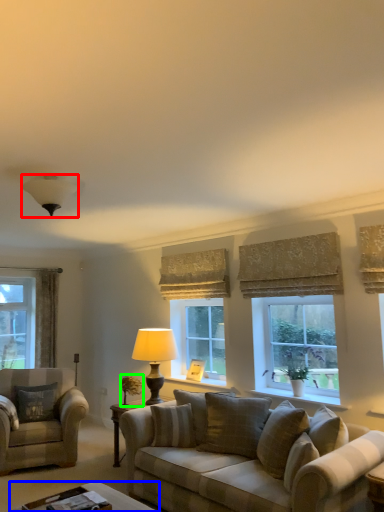
Question: Considering the real-world distances, which object is closest to lamp (highlighted by a red box)? table (highlighted by a blue box) or houseplant (highlighted by a green box).

Choices:
 (A) table
 (B) houseplant

Answer: (A)